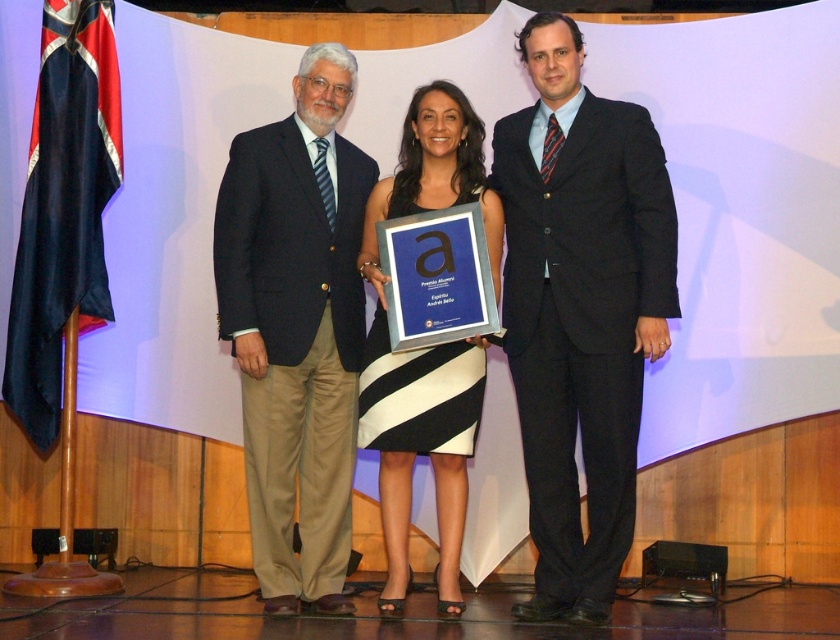
You are attending a formal event and notice the black and white striped dress at center on the stage. Based on its position, can you determine if it is closer to the front or the back of the stage?

The black and white striped dress at center is located at point 0.545 on the vertical axis and 0.507 on the horizontal axis, which places it centrally on the stage. Since the foreground includes the woman in the dress, it is closer to the front of the stage.

You are a photographer at the event. You need to adjust the lighting so that the black suit at center and the black and white striped dress at center are both visible. Which object should you focus on first to ensure proper exposure?

The black suit at center is above the black and white striped dress at center, so you should focus on the black suit at center first to ensure proper exposure since it is in a position that might be underexposed if not prioritized.

You are a photographer at the event and need to position a spotlight directly on the black suit at center. Given the coordinates provided, what are the exact coordinates where you should aim the spotlight?

The exact coordinates to aim the spotlight are at point (x=580, y=310), as that is the 2D location of the black suit at center.